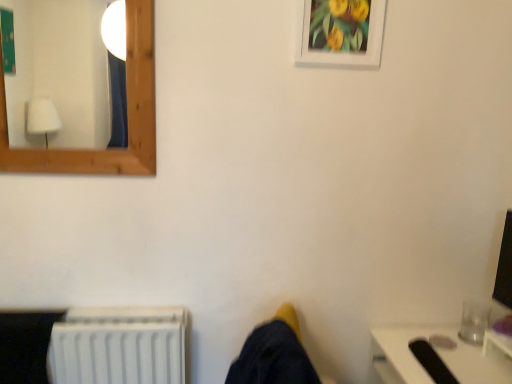
Question: Looking at their shapes, would you say white matte picture frame at upper center is wider or thinner than white plastic radiator at lower left?

Choices:
 (A) thin
 (B) wide

Answer: (A)

Question: Relative to white plastic radiator at lower left, is white matte picture frame at upper center in front or behind?

Choices:
 (A) front
 (B) behind

Answer: (A)

Question: Considering the real-world distances, which object is farthest from the white matte picture frame at upper center?

Choices:
 (A) white plastic radiator at lower left
 (B) wooden frame mirror at upper left

Answer: (B)

Question: Estimate the real-world distances between objects in this image. Which object is farther from the white plastic radiator at lower left?

Choices:
 (A) white matte picture frame at upper center
 (B) wooden frame mirror at upper left

Answer: (B)